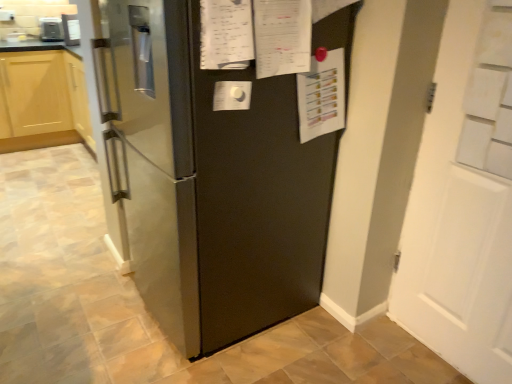
Describe the element at coordinates (51, 29) in the screenshot. I see `satin silver toaster at upper left, which is the second appliance from front to back` at that location.

Find the location of a particular element. The width and height of the screenshot is (512, 384). satin black refrigerator at center is located at coordinates (209, 182).

What do you see at coordinates (71, 29) in the screenshot? I see `satin silver refrigerator at upper left, which is the first appliance in front-to-back order` at bounding box center [71, 29].

At what (x,y) coordinates should I click in order to perform the action: click on satin silver toaster at upper left, which appears as the 1th appliance when viewed from the back. Please return your answer as a coordinate pair (x, y). This screenshot has height=384, width=512. Looking at the image, I should click on (51, 29).

Considering the sizes of objects satin silver toaster at upper left, placed as the 1th appliance when sorted from left to right, and satin black refrigerator at center in the image provided, who is thinner, satin silver toaster at upper left, placed as the 1th appliance when sorted from left to right, or satin black refrigerator at center?

satin silver toaster at upper left, placed as the 1th appliance when sorted from left to right.

Is satin silver toaster at upper left, which appears as the 1th appliance when viewed from the back, oriented towards satin black refrigerator at center?

Yes, satin silver toaster at upper left, which appears as the 1th appliance when viewed from the back, is aimed at satin black refrigerator at center.

Find the location of a particular element. Image resolution: width=512 pixels, height=384 pixels. refrigerator in front of the satin silver toaster at upper left, placed as the 1th appliance when sorted from left to right is located at coordinates (209, 182).

From a real-world perspective, is satin silver toaster at upper left, placed as the 1th appliance when sorted from left to right, above or below satin black refrigerator at center?

Clearly, from a real-world perspective, satin silver toaster at upper left, placed as the 1th appliance when sorted from left to right, is above satin black refrigerator at center.

What's the angular difference between satin silver refrigerator at upper left, which is the first appliance in front-to-back order, and satin black refrigerator at center's facing directions?

They differ by 37.9 degrees in their facing directions.

Would you say satin silver refrigerator at upper left, placed as the second appliance when sorted from back to front, is to the left or to the right of satin black refrigerator at center in the picture?

satin silver refrigerator at upper left, placed as the second appliance when sorted from back to front, is to the left of satin black refrigerator at center.

This screenshot has width=512, height=384. I want to click on refrigerator on the right of satin silver refrigerator at upper left, which is the first appliance in front-to-back order, so click(x=209, y=182).

Which is more distant, (64, 37) or (136, 176)?

Positioned behind is point (64, 37).

In the image, is satin silver refrigerator at upper left, arranged as the 2th appliance when viewed from the left, positioned in front of or behind white matte door at right?

Clearly, satin silver refrigerator at upper left, arranged as the 2th appliance when viewed from the left, is behind white matte door at right.

Considering the relative sizes of satin silver refrigerator at upper left, placed as the second appliance when sorted from back to front, and white matte door at right in the image provided, is satin silver refrigerator at upper left, placed as the second appliance when sorted from back to front, thinner than white matte door at right?

Incorrect, the width of satin silver refrigerator at upper left, placed as the second appliance when sorted from back to front, is not less than that of white matte door at right.

From the image's perspective, between satin silver refrigerator at upper left, which is the first appliance in front-to-back order, and white matte door at right, which one is located above?

From the image's view, satin silver refrigerator at upper left, which is the first appliance in front-to-back order, is above.

Which object is more forward, satin silver toaster at upper left, which is the second appliance from front to back, or white matte door at right?

white matte door at right is in front.

Is satin silver toaster at upper left, which is the second appliance from front to back, placed right next to white matte door at right?

satin silver toaster at upper left, which is the second appliance from front to back, is not next to white matte door at right, and they're not touching.

Considering the sizes of objects satin silver toaster at upper left, placed as the 1th appliance when sorted from left to right, and white matte door at right in the image provided, who is taller, satin silver toaster at upper left, placed as the 1th appliance when sorted from left to right, or white matte door at right?

With more height is white matte door at right.

Can you tell me how much satin black refrigerator at center and satin silver refrigerator at upper left, placed as the second appliance when sorted from back to front, differ in facing direction?

The angle between the facing direction of satin black refrigerator at center and the facing direction of satin silver refrigerator at upper left, placed as the second appliance when sorted from back to front, is 37.9 degrees.

Is the depth of satin black refrigerator at center less than that of satin silver refrigerator at upper left, which is the first appliance in front-to-back order?

Yes, the depth of satin black refrigerator at center is less than that of satin silver refrigerator at upper left, which is the first appliance in front-to-back order.

Does satin black refrigerator at center have a larger size compared to satin silver refrigerator at upper left, arranged as the 2th appliance when viewed from the left?

Yes, satin black refrigerator at center is bigger than satin silver refrigerator at upper left, arranged as the 2th appliance when viewed from the left.

Between satin black refrigerator at center and satin silver refrigerator at upper left, placed as the second appliance when sorted from back to front, which one appears on the left side from the viewer's perspective?

From the viewer's perspective, satin silver refrigerator at upper left, placed as the second appliance when sorted from back to front, appears more on the left side.

Is white matte door at right far away from satin silver refrigerator at upper left, which is the first appliance in front-to-back order?

Yes, white matte door at right and satin silver refrigerator at upper left, which is the first appliance in front-to-back order, are quite far apart.

Is satin silver refrigerator at upper left, arranged as the 2th appliance when viewed from the left, at the back of white matte door at right?

No, white matte door at right is not facing the opposite direction of satin silver refrigerator at upper left, arranged as the 2th appliance when viewed from the left.

Is white matte door at right closer to camera compared to satin silver refrigerator at upper left, which is the first appliance in front-to-back order?

Yes, it is.

From the image's perspective, between satin black refrigerator at center and white matte door at right, which one is located above?

satin black refrigerator at center is shown above in the image.

Is the depth of satin black refrigerator at center greater than that of white matte door at right?

Yes, satin black refrigerator at center is behind white matte door at right.

Are satin black refrigerator at center and white matte door at right making contact?

No, satin black refrigerator at center is not next to white matte door at right.

Where is `refrigerator that appears below the satin silver toaster at upper left, which is the second appliance from front to back (from a real-world perspective)`? This screenshot has width=512, height=384. refrigerator that appears below the satin silver toaster at upper left, which is the second appliance from front to back (from a real-world perspective) is located at coordinates point(209,182).

Starting from the satin black refrigerator at center, which appliance is the 1st one behind? Please provide its 2D coordinates.

[(71, 29)]

Which object lies nearer to the anchor point satin black refrigerator at center, white matte door at right or satin silver refrigerator at upper left, placed as the second appliance when sorted from back to front?

white matte door at right is closer to satin black refrigerator at center.

Estimate the real-world distances between objects in this image. Which object is further from satin silver refrigerator at upper left, which appears as the first appliance when viewed from the right, satin black refrigerator at center or white matte door at right?

Among the two, white matte door at right is located further to satin silver refrigerator at upper left, which appears as the first appliance when viewed from the right.

Estimate the real-world distances between objects in this image. Which object is further from satin black refrigerator at center, satin silver refrigerator at upper left, placed as the second appliance when sorted from back to front, or white matte door at right?

satin silver refrigerator at upper left, placed as the second appliance when sorted from back to front.

Considering their positions, is white matte door at right positioned closer to satin silver refrigerator at upper left, arranged as the 2th appliance when viewed from the left, than satin black refrigerator at center?

satin black refrigerator at center.

Based on their spatial positions, is satin silver refrigerator at upper left, arranged as the 2th appliance when viewed from the left, or satin black refrigerator at center further from satin silver toaster at upper left, placed as the 1th appliance when sorted from left to right?

satin black refrigerator at center.

In the scene shown: Which object lies nearer to the anchor point white matte door at right, satin silver toaster at upper left, placed as the 1th appliance when sorted from left to right, or satin black refrigerator at center?

The object closer to white matte door at right is satin black refrigerator at center.

Based on their spatial positions, is satin silver toaster at upper left, which appears as the 1th appliance when viewed from the back, or white matte door at right further from satin silver refrigerator at upper left, which appears as the first appliance when viewed from the right?

white matte door at right.

When comparing their distances from white matte door at right, does satin silver refrigerator at upper left, which is the first appliance in front-to-back order, or satin silver toaster at upper left, acting as the 2th appliance starting from the right, seem closer?

satin silver refrigerator at upper left, which is the first appliance in front-to-back order, is positioned closer to the anchor white matte door at right.

Find the location of a particular element. appliance positioned between white matte door at right and satin silver toaster at upper left, which is the second appliance from front to back, from near to far is located at coordinates (71, 29).

This screenshot has width=512, height=384. I want to click on refrigerator between white matte door at right and satin silver toaster at upper left, which is the second appliance from front to back, from front to back, so click(209, 182).

You are a GUI agent. You are given a task and a screenshot of the screen. Output one action in this format:
    pyautogui.click(x=<x>, y=<y>)
    Task: Click on the refrigerator between white matte door at right and satin silver refrigerator at upper left, which is the first appliance in front-to-back order, from front to back
    The image size is (512, 384).
    Given the screenshot: What is the action you would take?
    pyautogui.click(x=209, y=182)

In order to click on appliance between satin black refrigerator at center and satin silver toaster at upper left, which appears as the 1th appliance when viewed from the back, in the front-back direction in this screenshot , I will do `click(71, 29)`.